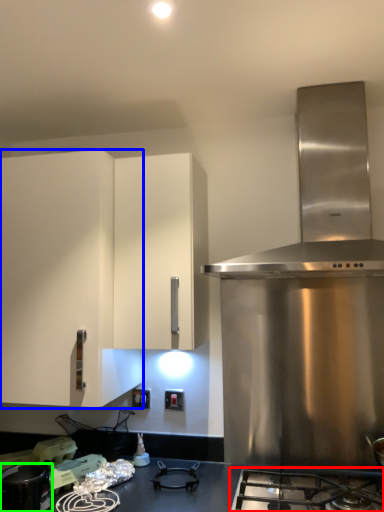
Question: Based on their relative distances, which object is nearer to gas stove (highlighted by a red box)? Choose from cabinetry (highlighted by a blue box) and kitchen appliance (highlighted by a green box).

Choices:
 (A) cabinetry
 (B) kitchen appliance

Answer: (B)